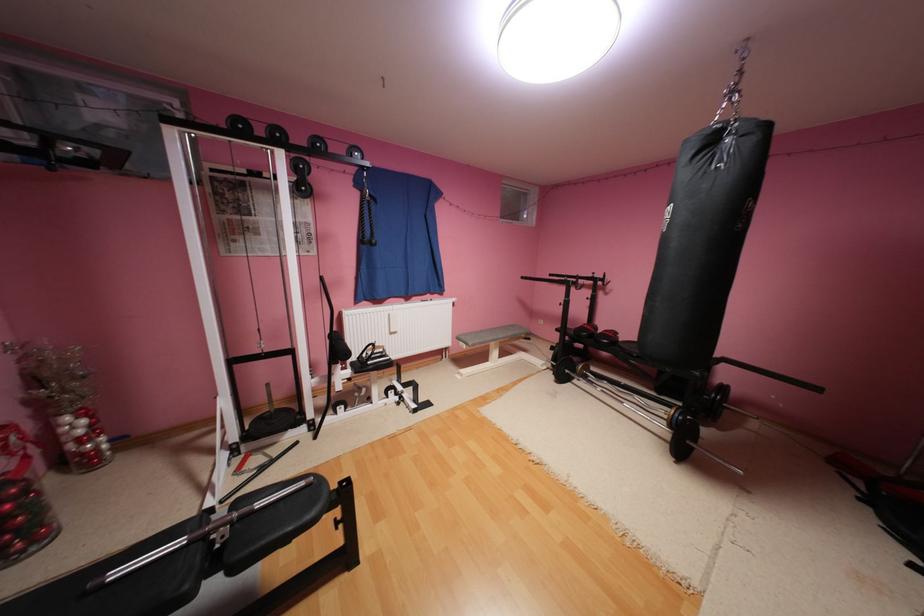
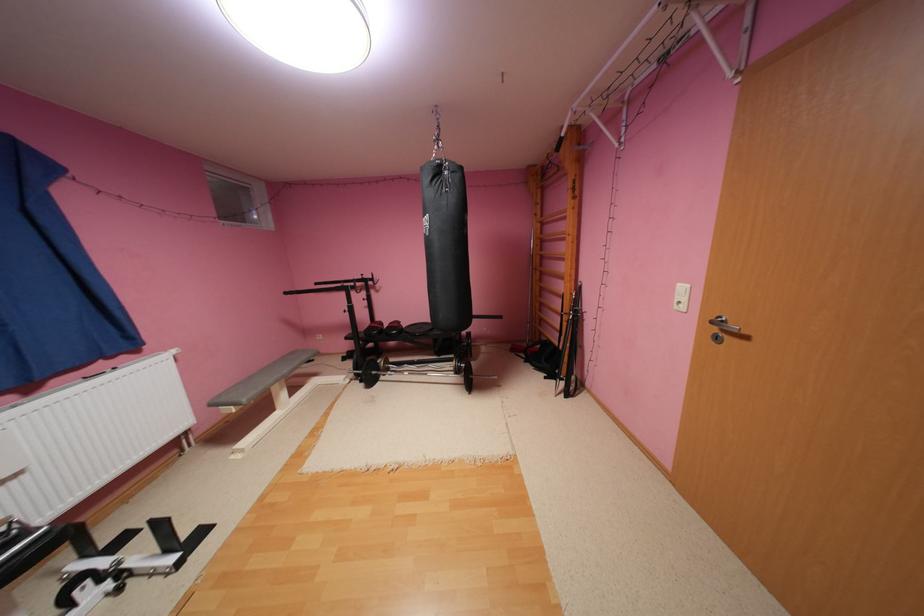
Question: I am providing you with two images of the same scene from different viewpoints. Please identify which objects are invisible in image2.

Choices:
 (A) black pull-down bar
 (B) wooden ladder rung
 (C) silver door handle
 (D) none of these

Answer: (D)